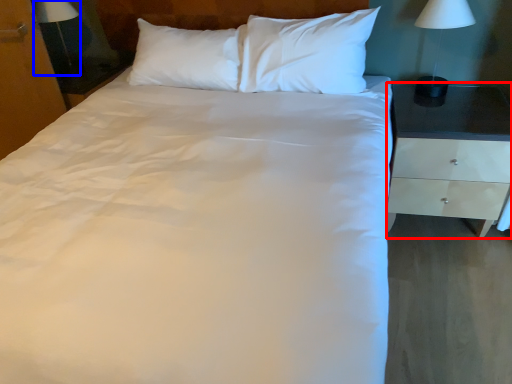
Question: Which of the following is the farthest to the observer, nightstand (highlighted by a red box) or bedside lamp (highlighted by a blue box)?

Choices:
 (A) nightstand
 (B) bedside lamp

Answer: (B)